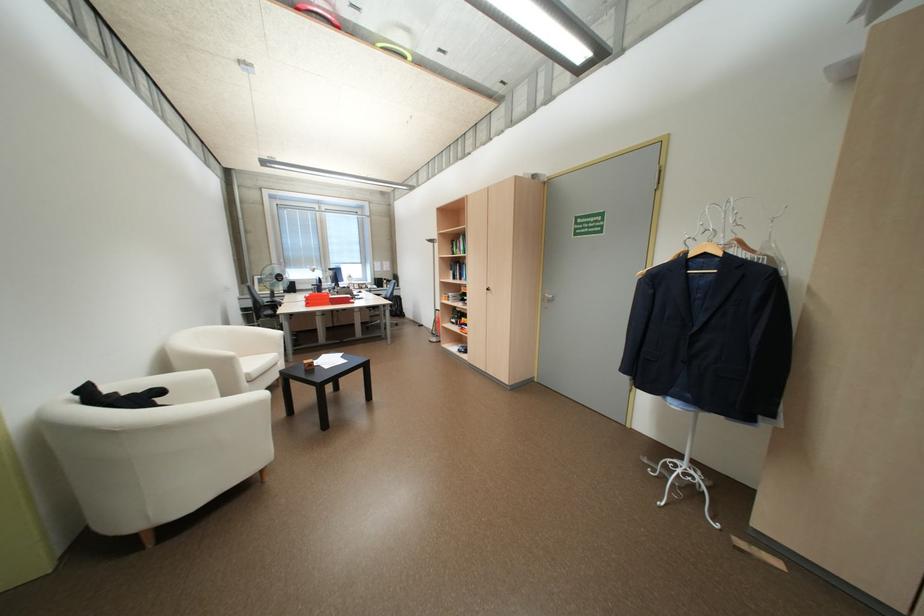
What do you see at coordinates (258, 361) in the screenshot?
I see `the white chair sitting surface` at bounding box center [258, 361].